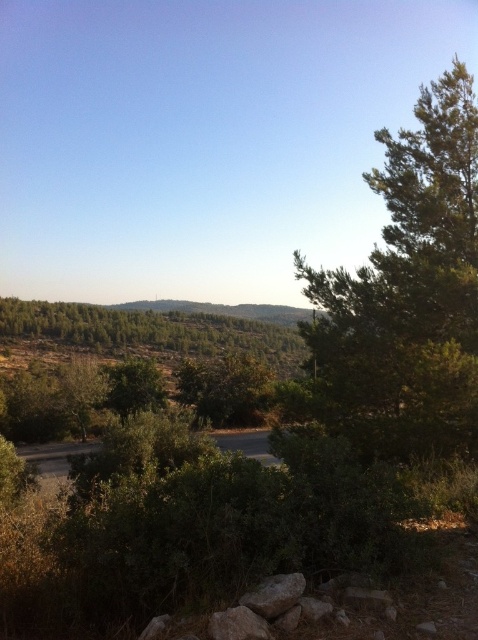
Question: Is green leafy tree at right behind green textured hill at center?

Choices:
 (A) yes
 (B) no

Answer: (B)

Question: Which point appears closest to the camera in this image?

Choices:
 (A) (297, 355)
 (B) (333, 365)

Answer: (B)

Question: Does green leafy tree at right come behind green textured hillside at center?

Choices:
 (A) no
 (B) yes

Answer: (A)

Question: Which object is farther from the camera taking this photo?

Choices:
 (A) green leafy tree at right
 (B) green textured hillside at center

Answer: (B)

Question: Can you confirm if green leafy tree at right is positioned above green textured hill at center?

Choices:
 (A) no
 (B) yes

Answer: (B)

Question: Estimate the real-world distances between objects in this image. Which object is farther from the green textured hillside at center?

Choices:
 (A) green leafy tree at right
 (B) green textured hill at center

Answer: (A)